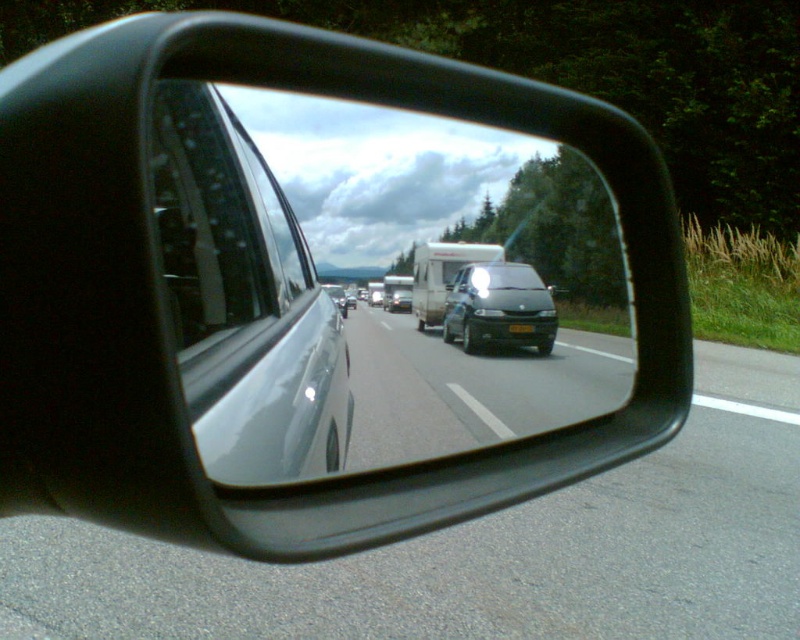
Question: Can you confirm if white glossy trailer truck at center is bigger than white matte trailer truck at center?

Choices:
 (A) no
 (B) yes

Answer: (A)

Question: Which object is positioned farthest from the satin silver sedan at center?

Choices:
 (A) white matte trailer truck at center
 (B) satin silver van at center
 (C) black glossy minivan at center

Answer: (A)

Question: Is matte black van at center behind satin silver van at center?

Choices:
 (A) yes
 (B) no

Answer: (A)

Question: Which object is closer to the camera taking this photo?

Choices:
 (A) matte black van at center
 (B) satin silver sedan at center

Answer: (B)

Question: Which point appears closest to the camera in this image?

Choices:
 (A) (448, 314)
 (B) (340, 291)
 (C) (496, 250)

Answer: (B)

Question: Is black glossy minivan at center to the right of white glossy trailer truck at center from the viewer's perspective?

Choices:
 (A) no
 (B) yes

Answer: (B)